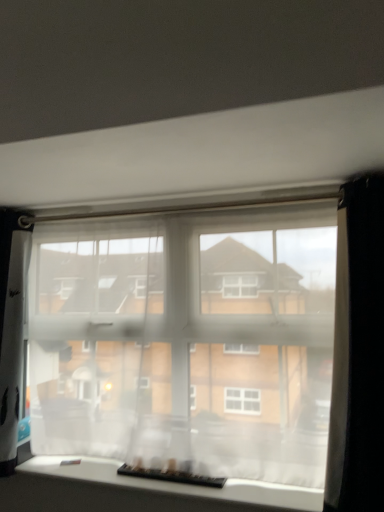
Locate an element on the screen. The width and height of the screenshot is (384, 512). vacant space situated on the left part of black plastic keyboard at lower center is located at coordinates (106, 471).